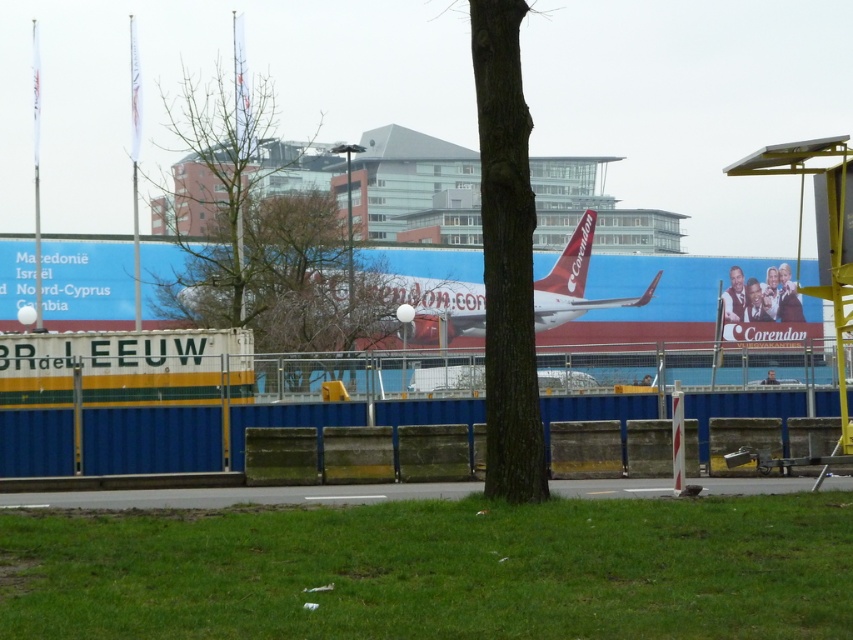
Who is taller, gray asphalt at lower center or red matte airliner at center?

Standing taller between the two is red matte airliner at center.

Is point (596, 481) positioned in front of point (579, 243)?

Yes, point (596, 481) is closer to viewer.

Describe the element at coordinates (235, 496) in the screenshot. I see `gray asphalt at lower center` at that location.

Where is `gray asphalt at lower center`? The width and height of the screenshot is (853, 640). gray asphalt at lower center is located at coordinates (235, 496).